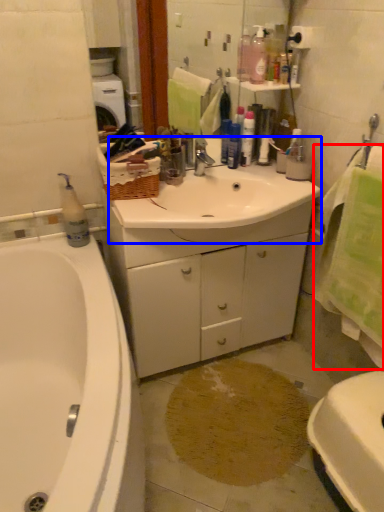
Question: Which object is further to the camera taking this photo, bath towel (highlighted by a red box) or sink (highlighted by a blue box)?

Choices:
 (A) bath towel
 (B) sink

Answer: (B)